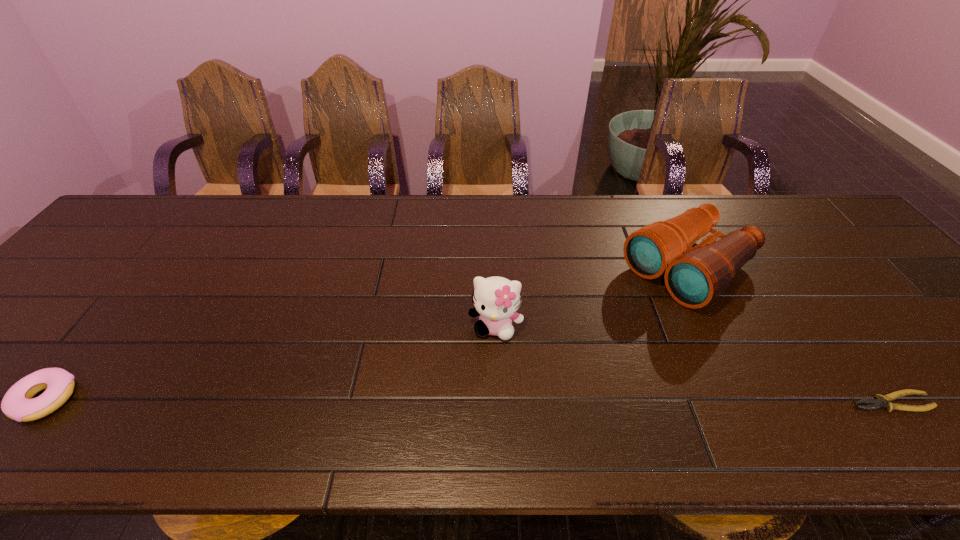
Locate an element on the screen. The image size is (960, 540). free spot located through the lenses of the binoculars is located at coordinates point(545,368).

Identify the location of object situated at the far edge. (695, 276).

You are a GUI agent. You are given a task and a screenshot of the screen. Output one action in this format:
    pyautogui.click(x=<x>, y=<y>)
    Task: Click on the object situated at the near edge
    The width and height of the screenshot is (960, 540).
    Given the screenshot: What is the action you would take?
    pyautogui.click(x=880, y=402)

Find the location of `blank space at the far edge of the desktop`. blank space at the far edge of the desktop is located at coordinates (587, 235).

This screenshot has height=540, width=960. In the image, there is a desktop. What are the coordinates of `free space at the near edge` in the screenshot? It's located at (812, 402).

Locate an element on the screen. vacant space at the left edge of the desktop is located at coordinates (68, 273).

What are the coordinates of `empty location between the third object from left to right and the kitten` in the screenshot? It's located at (592, 298).

You are a GUI agent. You are given a task and a screenshot of the screen. Output one action in this format:
    pyautogui.click(x=<x>, y=<y>)
    Task: Click on the free point between the rightmost object and the second object from right to left
    
    Given the screenshot: What is the action you would take?
    pyautogui.click(x=790, y=336)

I want to click on free space between the kitten and the rightmost object, so (693, 364).

I want to click on free space that is in between the pliers and the kitten, so click(x=693, y=364).